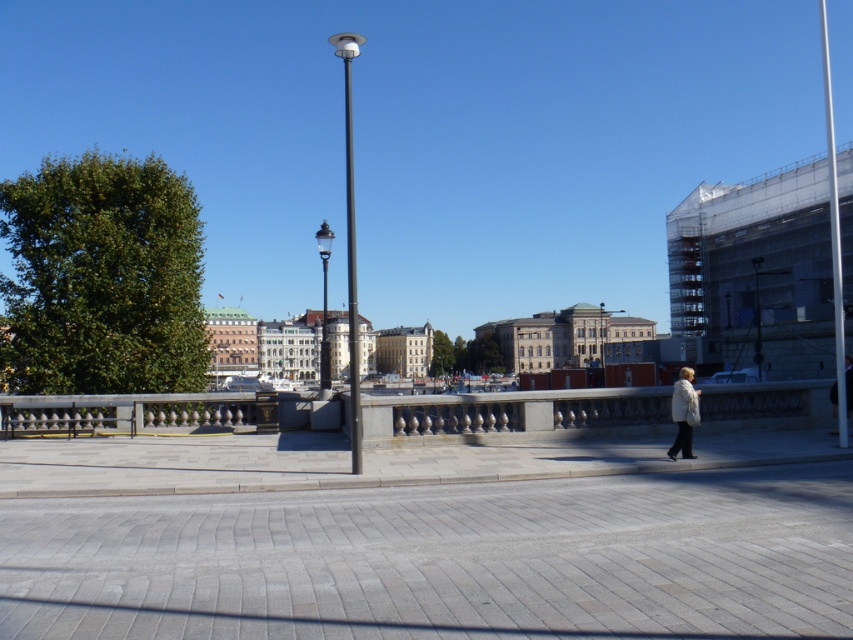
Which of these two, gray brick pavement at center or white fuzzy coat at lower right, stands taller?

Standing taller between the two is white fuzzy coat at lower right.

You are a GUI agent. You are given a task and a screenshot of the screen. Output one action in this format:
    pyautogui.click(x=<x>, y=<y>)
    Task: Click on the gray brick pavement at center
    Image resolution: width=853 pixels, height=640 pixels.
    Given the screenshot: What is the action you would take?
    pyautogui.click(x=444, y=560)

Identify the location of gray brick pavement at center. (444, 560).

Does gray brick pavement at center have a lesser width compared to black metal lamp post at center?

Correct, gray brick pavement at center's width is less than black metal lamp post at center's.

Is gray brick pavement at center smaller than black metal lamp post at center?

Correct, gray brick pavement at center occupies less space than black metal lamp post at center.

Is point (332, 499) more distant than point (329, 355)?

No, it is in front of (329, 355).

This screenshot has width=853, height=640. Find the location of `gray brick pavement at center`. gray brick pavement at center is located at coordinates (444, 560).

Is gray brick pavement at center wider than black polished metal streetlight at center?

No, gray brick pavement at center is not wider than black polished metal streetlight at center.

Does gray brick pavement at center lie behind black polished metal streetlight at center?

No, gray brick pavement at center is in front of black polished metal streetlight at center.

At what (x,y) coordinates should I click in order to perform the action: click on gray brick pavement at center. Please return your answer as a coordinate pair (x, y). This screenshot has height=640, width=853. Looking at the image, I should click on (444, 560).